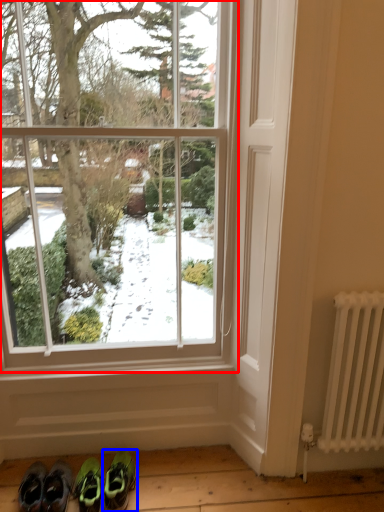
Question: Which object appears farthest to the camera in this image, window (highlighted by a red box) or footwear (highlighted by a blue box)?

Choices:
 (A) window
 (B) footwear

Answer: (B)